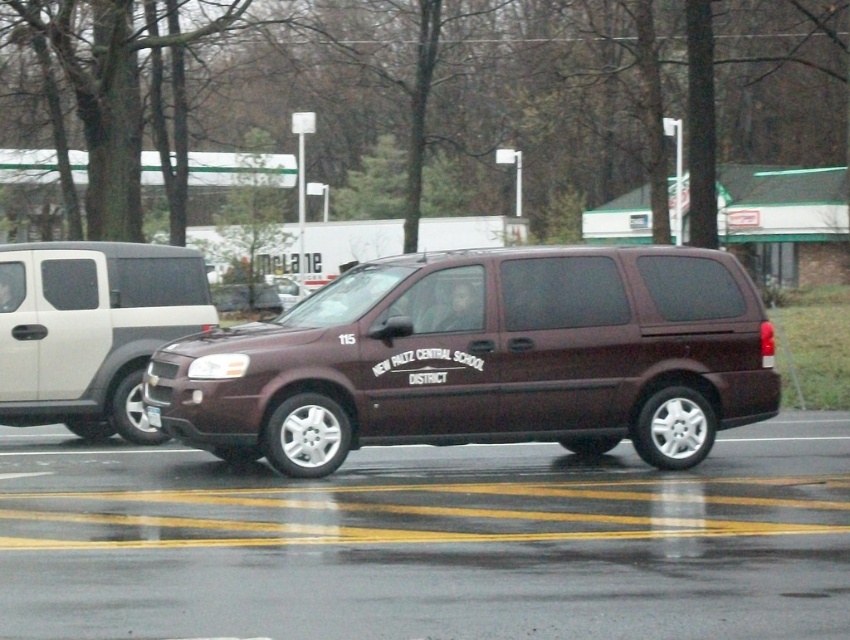
You are a pedestrian standing on the sidewalk next to the satin dark brown minivan at center. You want to cross the road to reach the matte black van at center. The road is 12 meters wide. Can you safely cross the road without needing to walk on the road?

The satin dark brown minivan at center is 12.32 meters from the matte black van at center. Since the road is 12 meters wide, the distance between the two vehicles is slightly longer than the road width. Therefore, you can safely cross the road without needing to walk on the road by staying on the sidewalk between them.

You are a traffic officer observing the scene. You need to determine if the black matte license plate at center is visible from the front of the satin dark brown minivan at center. Based on their sizes, can you confirm this?

The satin dark brown minivan at center is larger than the black matte license plate at center, so the license plate is likely visible from the front of the minivan as it is smaller in size.

You are a pedestrian standing on the sidewalk. You see the matte white suv at left and the black matte license plate at center. Which object is closer to the left side of the road?

The matte white suv at left is closer to the left side of the road because it is positioned to the left of the black matte license plate at center.